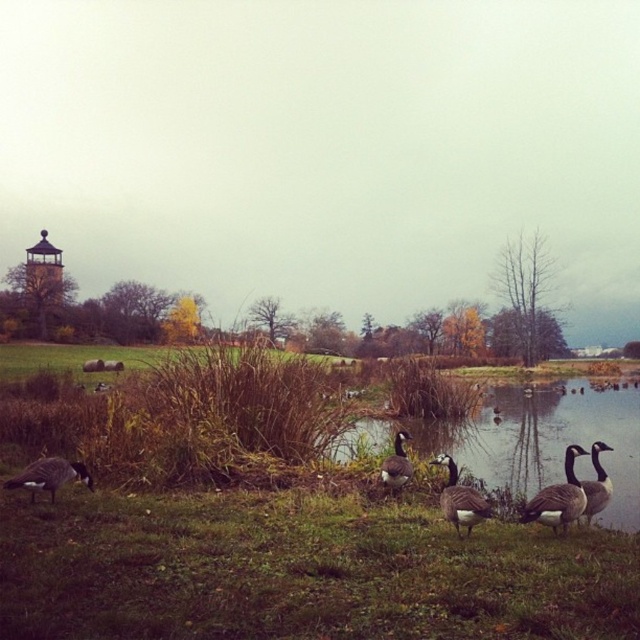
Is gray matte goose at lower left to the left of dark gray feathers at lower right from the viewer's perspective?

Indeed, gray matte goose at lower left is positioned on the left side of dark gray feathers at lower right.

Which is above, gray matte goose at lower left or dark gray feathers at lower right?

dark gray feathers at lower right is above.

Which is in front, point (52, 458) or point (593, 456)?

Point (593, 456)

The height and width of the screenshot is (640, 640). What are the coordinates of `gray matte goose at lower left` in the screenshot? It's located at (49, 476).

Does gray matte goose at center have a greater height compared to gray matte duck at center?

No.

Does gray matte goose at center have a greater width compared to gray matte duck at center?

Yes.

Is point (458, 504) behind point (392, 483)?

No, (458, 504) is in front of (392, 483).

This screenshot has width=640, height=640. I want to click on gray matte goose at center, so click(460, 499).

Does point (488, 515) lie in front of point (42, 476)?

Yes, point (488, 515) is in front of point (42, 476).

Measure the distance between point [490,509] and camera.

Point [490,509] and camera are 8.07 meters apart.

I want to click on gray matte goose at center, so [x=460, y=499].

Find the location of a particular element. The width and height of the screenshot is (640, 640). gray matte goose at center is located at coordinates (460, 499).